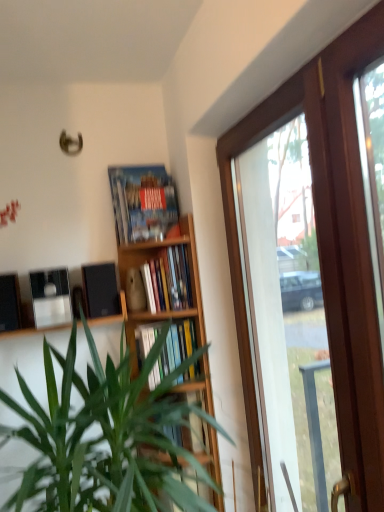
Question: Does black matte speaker at left, the first loudspeaker positioned from the left, appear on the right side of wooden frame at right?

Choices:
 (A) yes
 (B) no

Answer: (B)

Question: Can you confirm if black matte speaker at left, which ranks as the 2th loudspeaker in right-to-left order, is bigger than wooden frame at right?

Choices:
 (A) no
 (B) yes

Answer: (A)

Question: Is wooden frame at right located within black matte speaker at left, which ranks as the 2th loudspeaker in right-to-left order?

Choices:
 (A) yes
 (B) no

Answer: (B)

Question: Is black matte speaker at left, the first loudspeaker positioned from the left, smaller than wooden frame at right?

Choices:
 (A) no
 (B) yes

Answer: (B)

Question: Can you confirm if black matte speaker at left, which ranks as the 2th loudspeaker in right-to-left order, is wider than wooden frame at right?

Choices:
 (A) no
 (B) yes

Answer: (B)

Question: Is black matte speaker at left, the first loudspeaker positioned from the left, situated inside hardcover book at center, marked as the 1th book in a bottom-to-top arrangement, or outside?

Choices:
 (A) inside
 (B) outside

Answer: (B)

Question: Looking at the image, does black matte speaker at left, the first loudspeaker positioned from the left, seem bigger or smaller compared to hardcover book at center, marked as the 1th book in a bottom-to-top arrangement?

Choices:
 (A) big
 (B) small

Answer: (B)

Question: From the image's perspective, is black matte speaker at left, which ranks as the 2th loudspeaker in right-to-left order, located above or below hardcover book at center, marked as the 1th book in a bottom-to-top arrangement?

Choices:
 (A) above
 (B) below

Answer: (A)

Question: Considering the relative positions of black matte speaker at left, the first loudspeaker positioned from the left, and hardcover book at center, marked as the 1th book in a bottom-to-top arrangement, in the image provided, is black matte speaker at left, the first loudspeaker positioned from the left, to the left or to the right of hardcover book at center, marked as the 1th book in a bottom-to-top arrangement,?

Choices:
 (A) right
 (B) left

Answer: (B)

Question: Looking at their shapes, would you say black matte speaker at left, which ranks as the 2th loudspeaker in right-to-left order, is wider or thinner than green leafy plant at center?

Choices:
 (A) thin
 (B) wide

Answer: (A)

Question: From a real-world perspective, is black matte speaker at left, the first loudspeaker positioned from the left, above or below green leafy plant at center?

Choices:
 (A) above
 (B) below

Answer: (A)

Question: Is black matte speaker at left, which ranks as the 2th loudspeaker in right-to-left order, to the left or to the right of green leafy plant at center in the image?

Choices:
 (A) right
 (B) left

Answer: (B)

Question: Is point (14, 306) closer or farther from the camera than point (105, 426)?

Choices:
 (A) farther
 (B) closer

Answer: (A)

Question: Is point (89, 326) positioned closer to the camera than point (1, 330)?

Choices:
 (A) farther
 (B) closer

Answer: (A)

Question: From the image's perspective, is matte black shelf at center, the first shelf when ordered from top to bottom, positioned above or below black matte speaker at left, which ranks as the 2th loudspeaker in right-to-left order?

Choices:
 (A) above
 (B) below

Answer: (B)